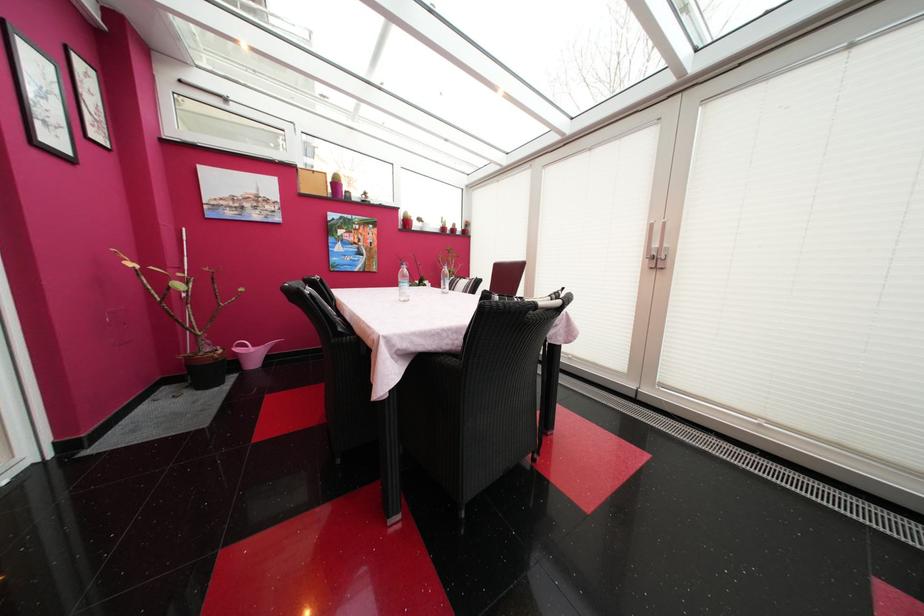
The image size is (924, 616). What are the coordinates of `white window handle` in the screenshot? It's located at pyautogui.click(x=655, y=246).